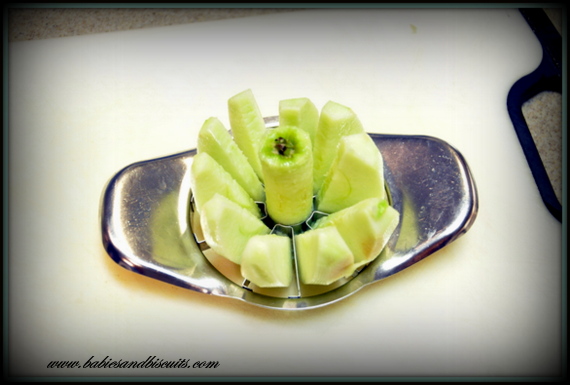
Locate an element on the screen. The image size is (570, 385). apple slicer is located at coordinates (431, 195).